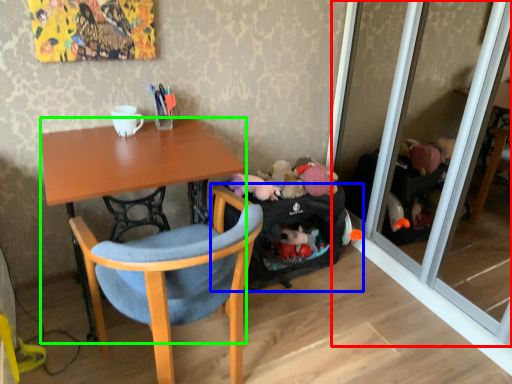
Question: Based on their relative distances, which object is farther from screen door (highlighted by a red box)? Choose from luggage and bags (highlighted by a blue box) and desk (highlighted by a green box).

Choices:
 (A) luggage and bags
 (B) desk

Answer: (B)